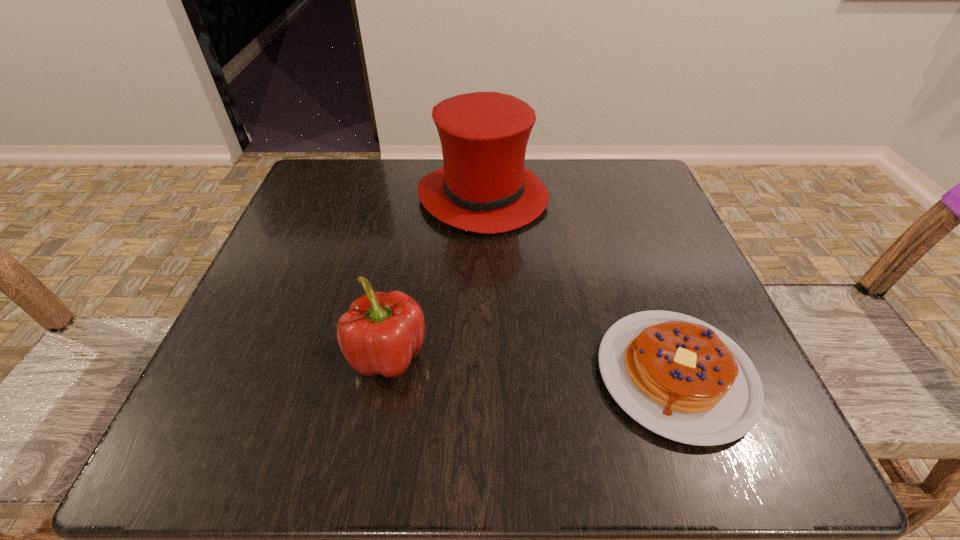
Locate an element on the screen. Image resolution: width=960 pixels, height=540 pixels. the farthest object is located at coordinates (483, 187).

This screenshot has height=540, width=960. In order to click on hat in this screenshot , I will do click(483, 187).

You are a GUI agent. You are given a task and a screenshot of the screen. Output one action in this format:
    pyautogui.click(x=<x>, y=<y>)
    Task: Click on the second tallest object
    Image resolution: width=960 pixels, height=540 pixels.
    Given the screenshot: What is the action you would take?
    pyautogui.click(x=381, y=332)

I want to click on pancake, so click(x=678, y=376).

Locate an element on the screen. the shortest object is located at coordinates (678, 376).

The width and height of the screenshot is (960, 540). I want to click on vacant space situated on the front of the hat, so 483,318.

What are the coordinates of `vacant position located on the right of the second shortest object` in the screenshot? It's located at (665, 355).

I want to click on free space located 0.220m on the left of the rightmost object, so click(x=447, y=375).

Find the location of `object that is at the far edge`. object that is at the far edge is located at coordinates pos(483,187).

The image size is (960, 540). In order to click on object located in the near edge section of the desktop in this screenshot , I will do `click(678, 376)`.